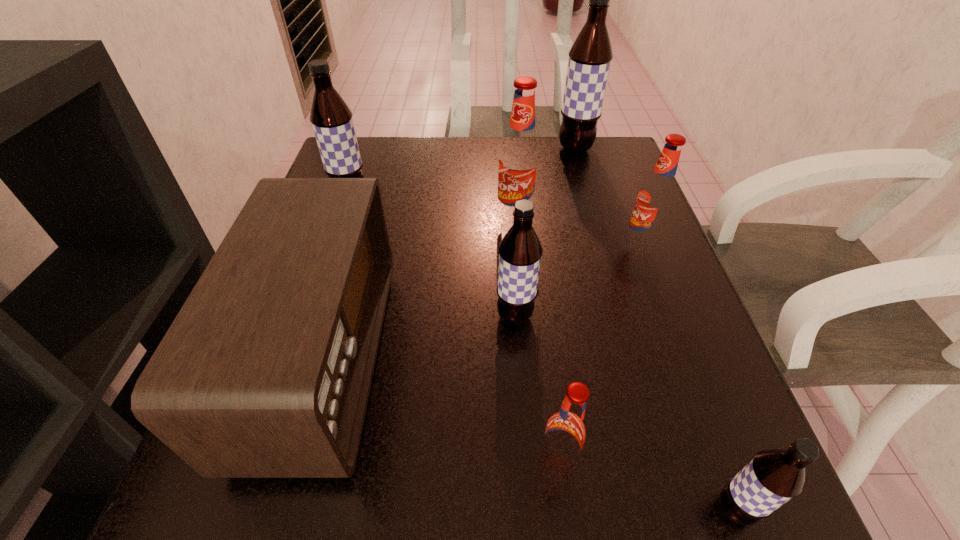
You are a GUI agent. You are given a task and a screenshot of the screen. Output one action in this format:
    pyautogui.click(x=<x>, y=<y>)
    Task: Click on the free point between the nearest red root beer and the second farthest red root beer
    The height and width of the screenshot is (540, 960).
    Given the screenshot: What is the action you would take?
    pyautogui.click(x=599, y=352)

I want to click on free space that is in between the second biggest brown root beer and the fourth nearest root beer, so click(x=495, y=221).

At what (x,y) coordinates should I click in order to perform the action: click on the second closest object relative to the radio receiver. Please return your answer as a coordinate pair (x, y). The width and height of the screenshot is (960, 540). Looking at the image, I should click on (331, 118).

Image resolution: width=960 pixels, height=540 pixels. I want to click on object that is the fourth closest one to the nearest brown root beer, so click(265, 372).

Identify which root beer is the sixth closest to the nearest root beer. Please provide its 2D coordinates. Your answer should be formatted as a tuple, i.e. [(x, y)], where the tuple contains the x and y coordinates of a point satisfying the conditions above.

[(331, 118)]

You are a GUI agent. You are given a task and a screenshot of the screen. Output one action in this format:
    pyautogui.click(x=<x>, y=<y>)
    Task: Click on the root beer object that ranks as the fourth closest to the tallest root beer
    This screenshot has height=540, width=960.
    Given the screenshot: What is the action you would take?
    pyautogui.click(x=520, y=251)

Locate which brown root beer is the second closest to the farthest object. Please provide its 2D coordinates. Your answer should be formatted as a tuple, i.e. [(x, y)], where the tuple contains the x and y coordinates of a point satisfying the conditions above.

[(520, 251)]

I want to click on brown root beer that is the second closest one to the third biggest brown root beer, so click(331, 118).

Where is `red root beer that stands as the closest to the tallest object`? The image size is (960, 540). red root beer that stands as the closest to the tallest object is located at coordinates (520, 155).

Select which red root beer is the second closest to the second smallest red root beer. Please provide its 2D coordinates. Your answer should be formatted as a tuple, i.e. [(x, y)], where the tuple contains the x and y coordinates of a point satisfying the conditions above.

[(566, 432)]